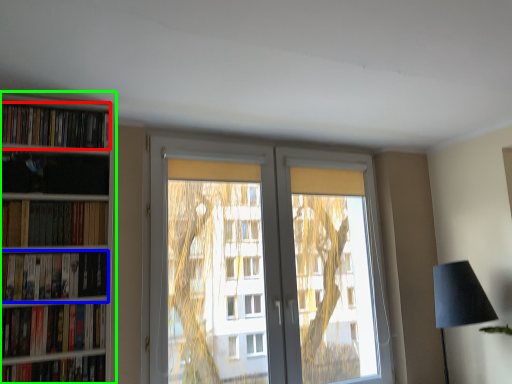
Question: Which object is positioned closest to book (highlighted by a red box)? Select from book (highlighted by a blue box) and bookcase (highlighted by a green box).

Choices:
 (A) book
 (B) bookcase

Answer: (B)